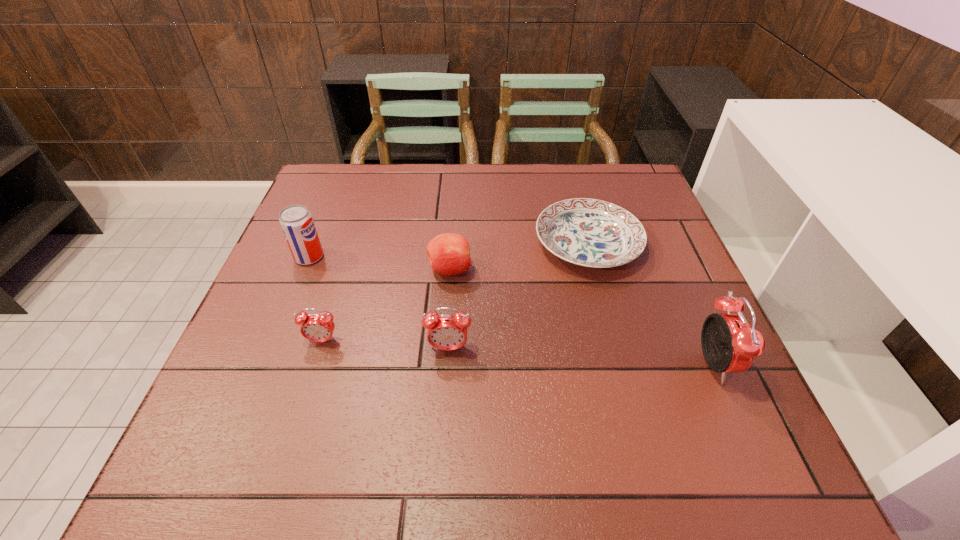
You are a GUI agent. You are given a task and a screenshot of the screen. Output one action in this format:
    pyautogui.click(x=<x>, y=<y>)
    Task: Click on the vacant position for inserting another alarm_clock evenly
    
    Given the screenshot: What is the action you would take?
    pyautogui.click(x=579, y=356)